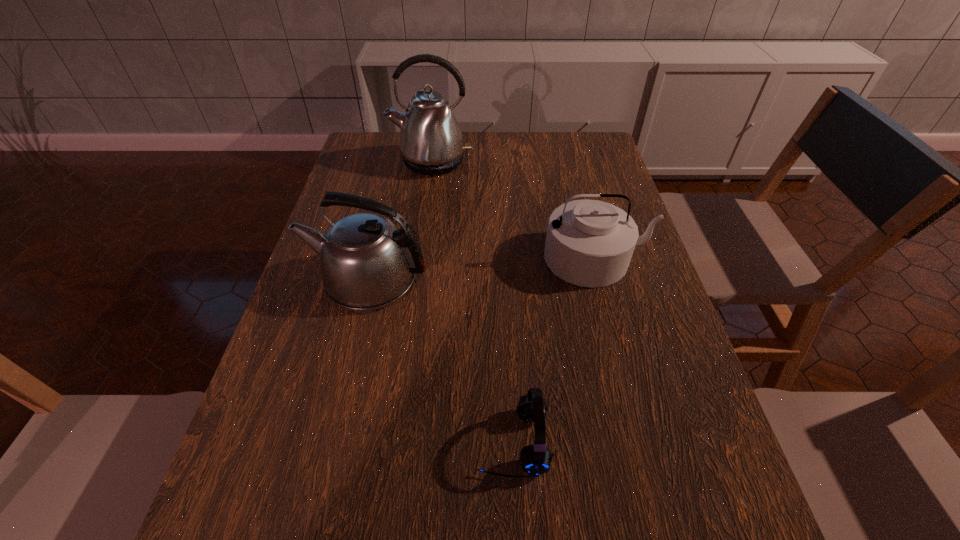
Identify which kettle is the nearest to the shortest object. Please provide its 2D coordinates. Your answer should be formatted as a tuple, i.e. [(x, y)], where the tuple contains the x and y coordinates of a point satisfying the conditions above.

[(366, 262)]